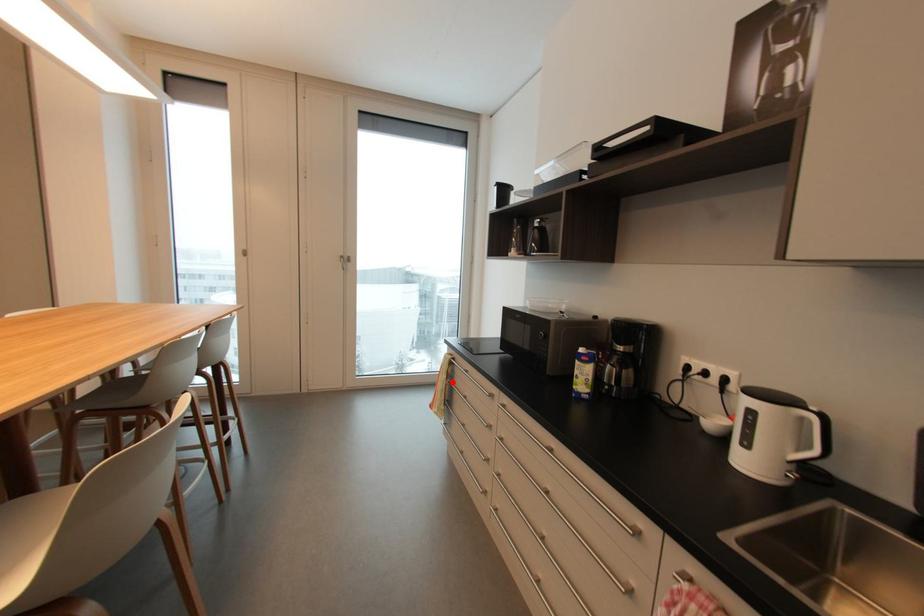
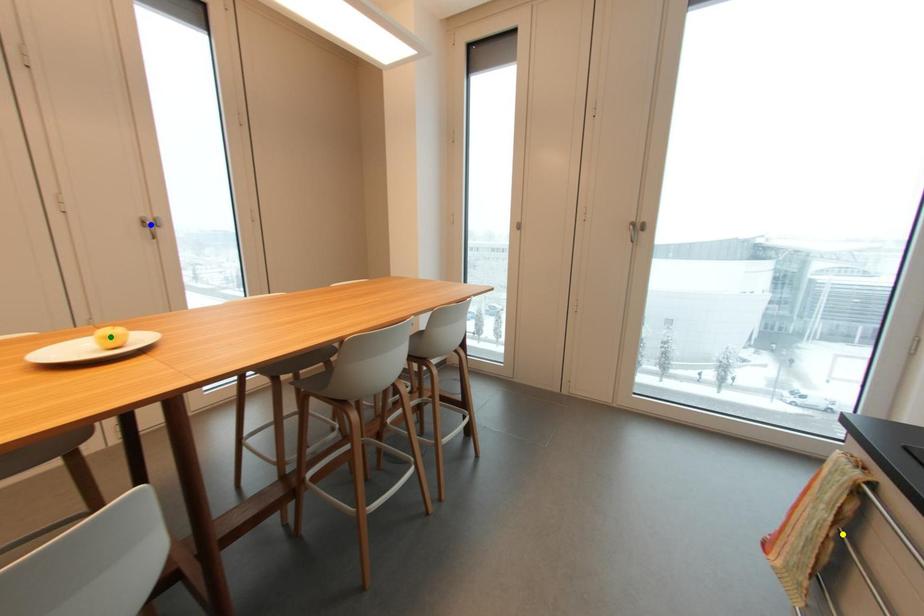
Question: I am providing you with two images of the same scene from different viewpoints. A red point is marked on the first image. You are given multiple points on the second image. Which point in image 2 represents the same 3d spot as the red point in image 1?

Choices:
 (A) blue point
 (B) yellow point
 (C) green point

Answer: (B)